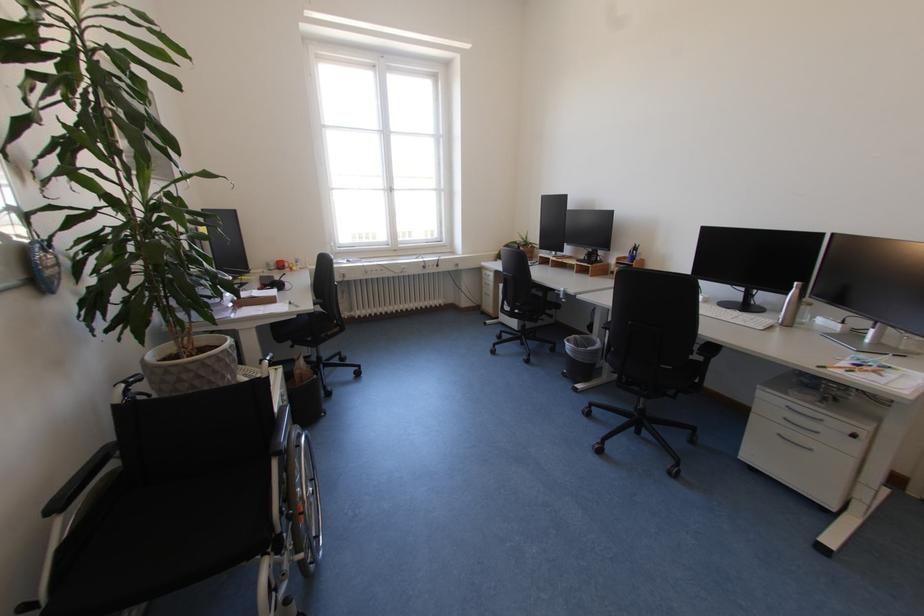
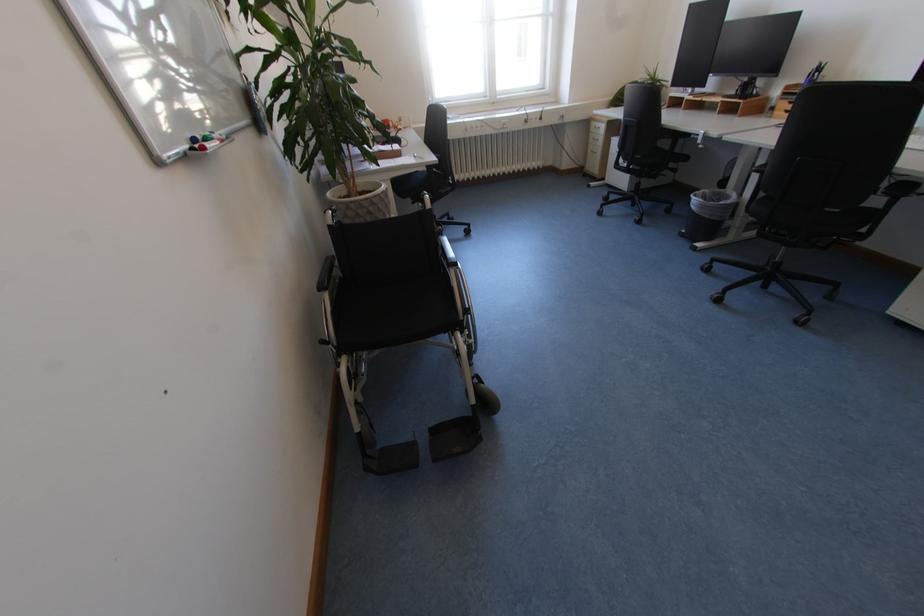
The images are taken continuously from a first-person perspective. In which direction are you moving?

The cameraman walked toward left, backward.